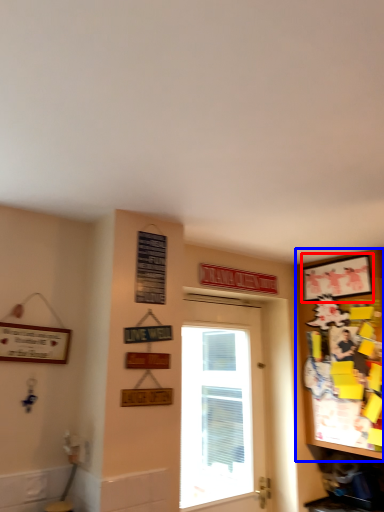
Question: Which point is closer to the camera, picture frame (highlighted by a red box) or cabinetry (highlighted by a blue box)?

Choices:
 (A) picture frame
 (B) cabinetry

Answer: (B)